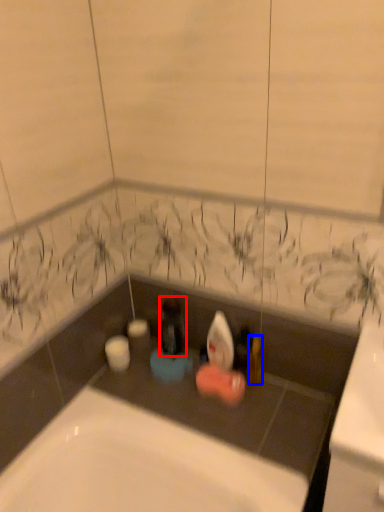
Question: Among these objects, which one is nearest to the camera, bottle (highlighted by a red box) or toiletry (highlighted by a blue box)?

Choices:
 (A) bottle
 (B) toiletry

Answer: (B)